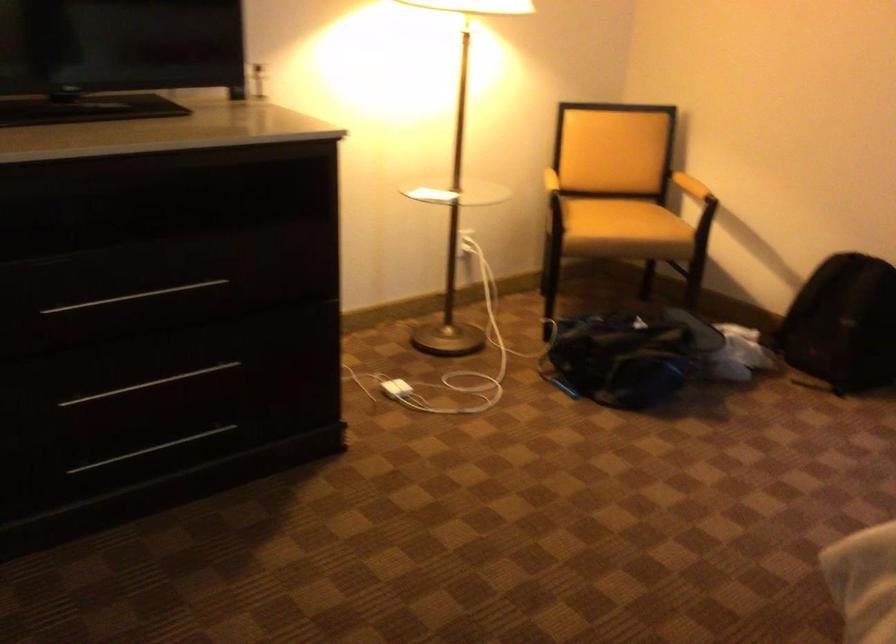
Locate an element on the screen. This screenshot has height=644, width=896. chair sitting surface is located at coordinates (623, 220).